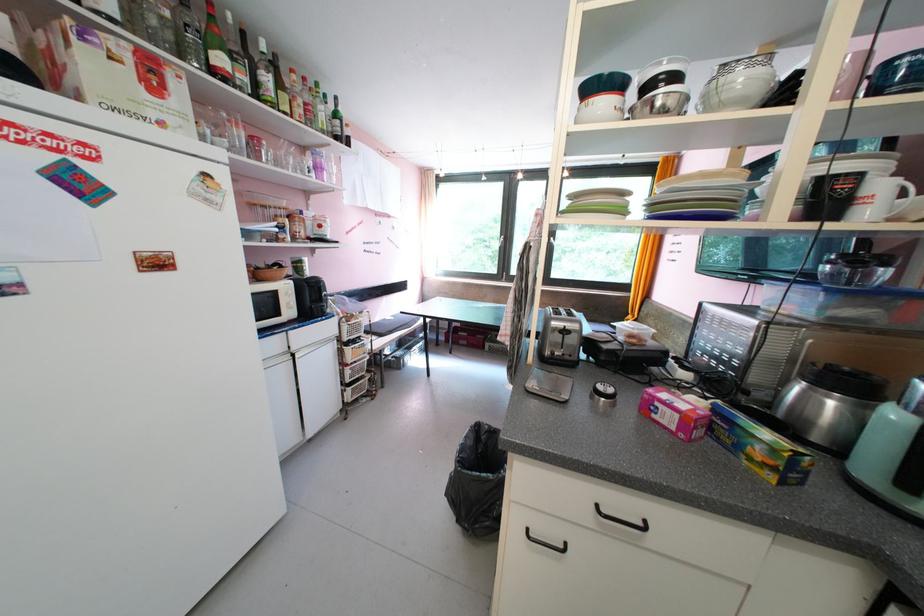
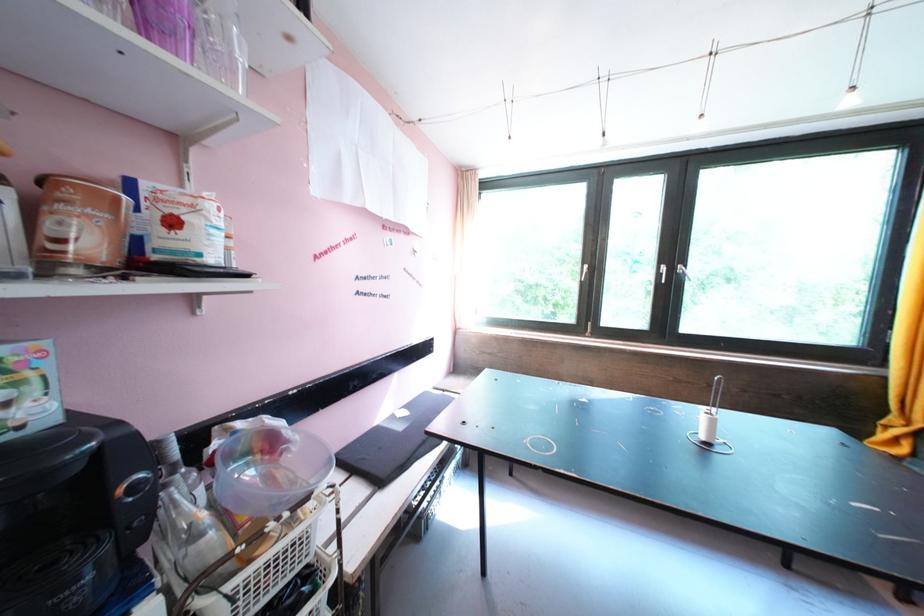
Question: What movement of the cameraman would produce the second image?

Choices:
 (A) Left
 (B) Right
 (C) Forward
 (D) Backward

Answer: (C)